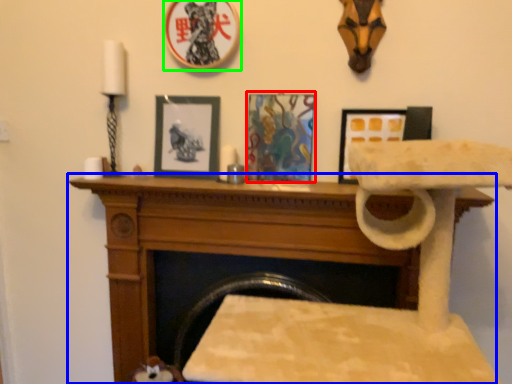
Question: Which is nearer to the picture frame (highlighted by a red box)? furniture (highlighted by a blue box) or picture frame (highlighted by a green box).

Choices:
 (A) furniture
 (B) picture frame

Answer: (A)